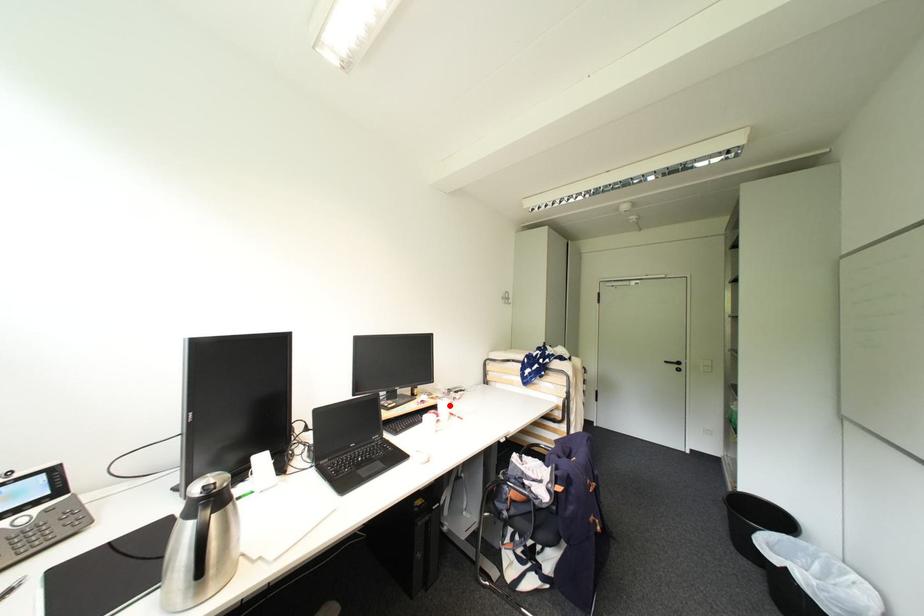
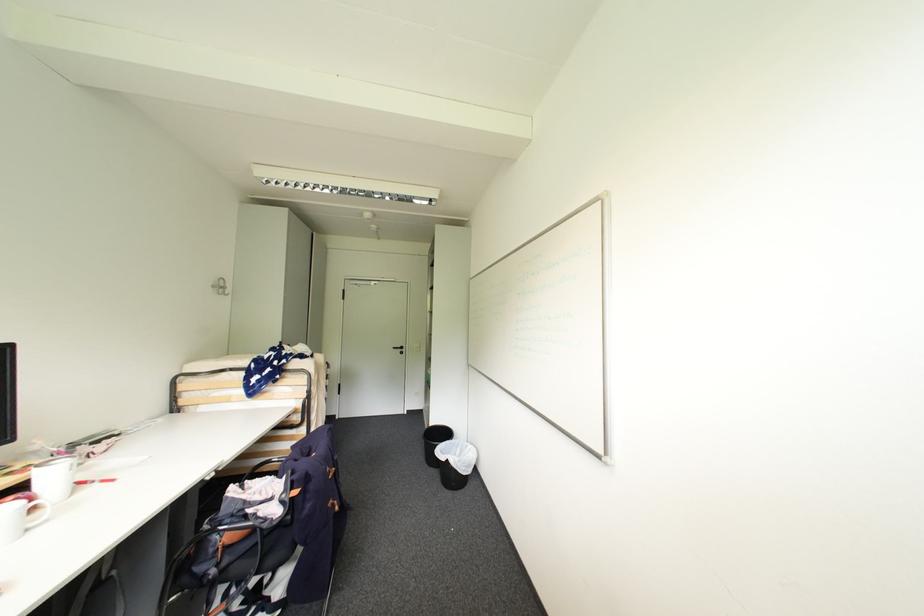
Where in the second image is the point corresponding to the highlighted location from the first image?

(58, 475)